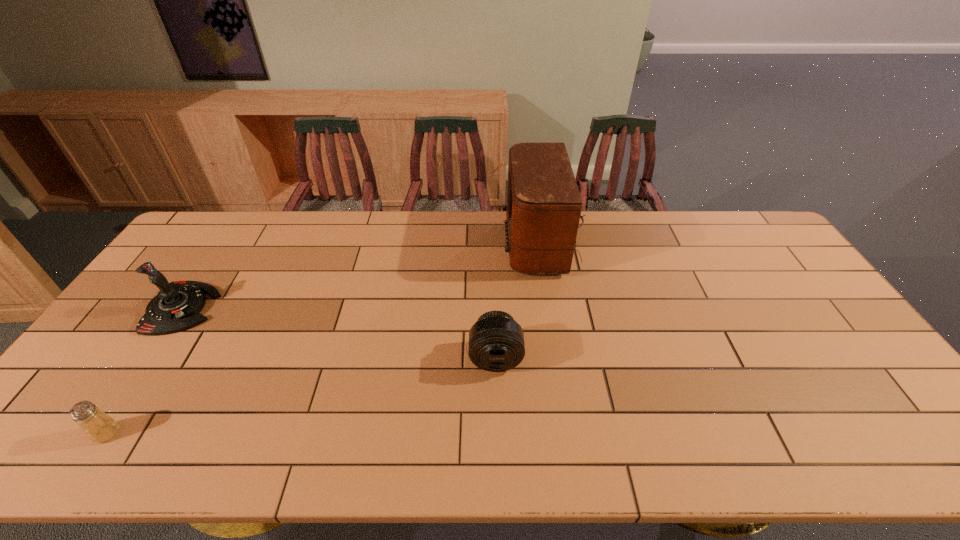
At what (x,y) coordinates should I click in order to perform the action: click on empty space that is in between the second farthest object and the shortest object. Please return your answer as a coordinate pair (x, y). Image resolution: width=960 pixels, height=540 pixels. Looking at the image, I should click on (145, 370).

Where is `vacant space that is in between the second nearest object and the farthest object`? vacant space that is in between the second nearest object and the farthest object is located at coordinates (522, 300).

Identify the location of vacant point located between the third nearest object and the farthest object. (366, 276).

Locate an element on the screen. This screenshot has width=960, height=540. blank region between the second farthest object and the nearest object is located at coordinates (145, 370).

Point out which object is positioned as the second nearest to the third shortest object. Please provide its 2D coordinates. Your answer should be formatted as a tuple, i.e. [(x, y)], where the tuple contains the x and y coordinates of a point satisfying the conditions above.

[(496, 341)]

Image resolution: width=960 pixels, height=540 pixels. Identify the location of object that stands as the second closest to the shortest object. (496, 341).

The width and height of the screenshot is (960, 540). In order to click on free location that satisfies the following two spatial constraints: 1. on the handle side of the third shortest object; 2. on the right side of the saltshaker in this screenshot , I will do `click(99, 433)`.

Locate an element on the screen. This screenshot has height=540, width=960. vacant area that satisfies the following two spatial constraints: 1. on the handle side of the third shortest object; 2. on the back side of the nearest object is located at coordinates (99, 433).

In order to click on vacant area in the image that satisfies the following two spatial constraints: 1. on the back side of the saltshaker; 2. on the handle side of the joystick in this screenshot , I will do `click(189, 308)`.

You are a GUI agent. You are given a task and a screenshot of the screen. Output one action in this format:
    pyautogui.click(x=<x>, y=<y>)
    Task: Click on the vacant region that satisfies the following two spatial constraints: 1. on the handle side of the nearest object; 2. on the left side of the joystick
    The width and height of the screenshot is (960, 540).
    Given the screenshot: What is the action you would take?
    pyautogui.click(x=99, y=433)